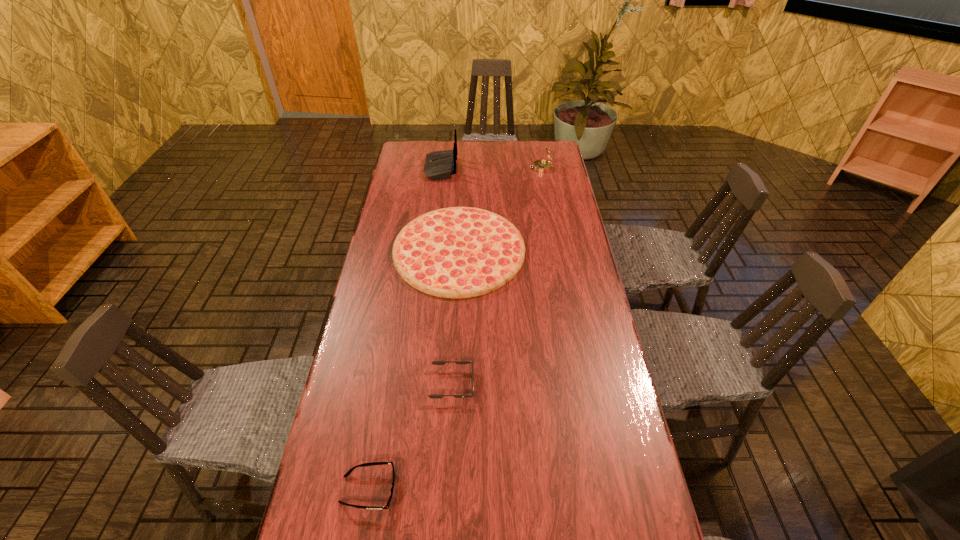
Identify the location of vacant space located with the dial facing the second tallest object. Image resolution: width=960 pixels, height=540 pixels. (444, 168).

Locate an element on the screen. vacant region located with the dial facing the second tallest object is located at coordinates (498, 168).

This screenshot has width=960, height=540. Identify the location of free space located on the temples of the right sunglasses. (605, 384).

The image size is (960, 540). In order to click on vacant point located 0.300m on the front of the pizza in this screenshot , I will do `click(452, 382)`.

Image resolution: width=960 pixels, height=540 pixels. What are the coordinates of `vacant space located on the front-facing side of the nearer sunglasses` in the screenshot? It's located at (480, 490).

Locate an element on the screen. This screenshot has height=540, width=960. router at the far edge is located at coordinates (439, 165).

This screenshot has height=540, width=960. In order to click on compass present at the far edge in this screenshot , I will do `click(542, 166)`.

Locate an element on the screen. The height and width of the screenshot is (540, 960). router present at the left edge is located at coordinates (439, 165).

What are the coordinates of `pizza that is at the left edge` in the screenshot? It's located at (458, 252).

The height and width of the screenshot is (540, 960). Identify the location of sunglasses that is at the left edge. (348, 473).